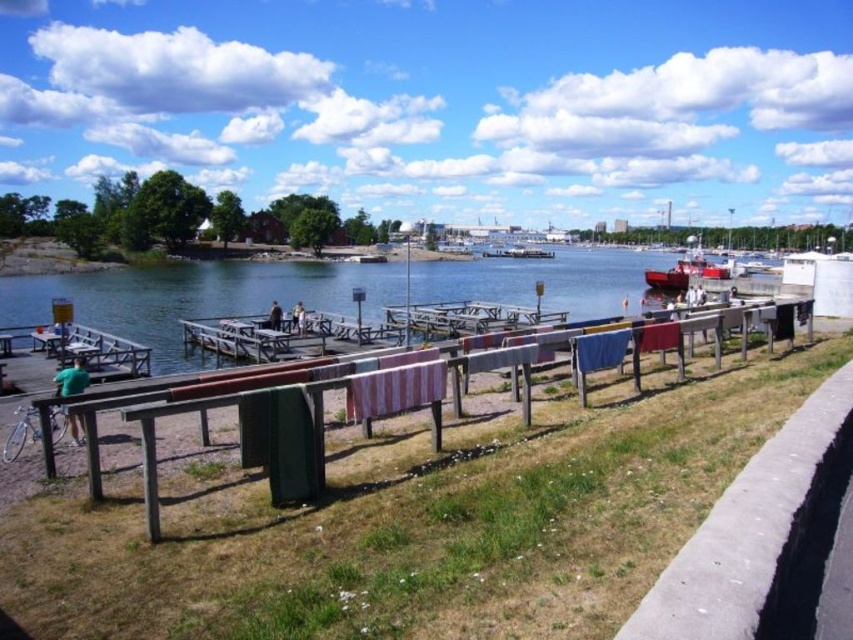
Is point (579, 508) positioned before point (195, 365)?

Yes, point (579, 508) is closer to viewer.

Is green grass at lower center thinner than clear water at center?

Indeed, green grass at lower center has a lesser width compared to clear water at center.

Which is behind, point (567, 448) or point (283, 308)?

Point (283, 308)

Where is `green grass at lower center`? The image size is (853, 640). green grass at lower center is located at coordinates (410, 525).

Can you confirm if clear water at center is positioned above white matte boat at center?

No.

At what (x,y) coordinates should I click in order to perform the action: click on clear water at center. Please return your answer as a coordinate pair (x, y). The height and width of the screenshot is (640, 853). Looking at the image, I should click on (198, 298).

Find the location of a particular element. clear water at center is located at coordinates (198, 298).

Is green grass at lower center closer to the viewer compared to white matte boat at center?

Yes, it is.

From the picture: Is green grass at lower center taller than white matte boat at center?

No, green grass at lower center is not taller than white matte boat at center.

What are the coordinates of `green grass at lower center` in the screenshot? It's located at (410, 525).

Find the location of a particular element. The height and width of the screenshot is (640, 853). green grass at lower center is located at coordinates (410, 525).